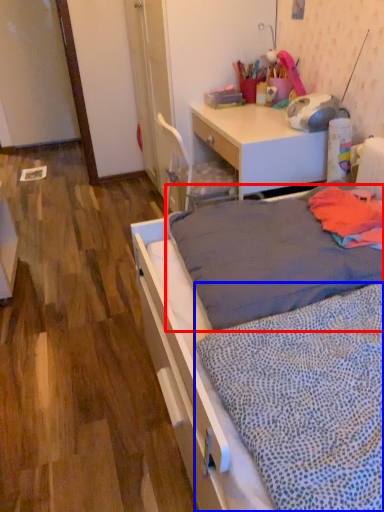
Question: Among these objects, which one is nearest to the camera, mattress (highlighted by a red box) or blanket (highlighted by a blue box)?

Choices:
 (A) mattress
 (B) blanket

Answer: (B)